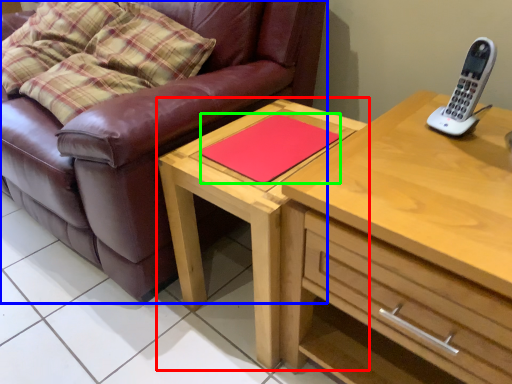
Question: Which object is positioned closest to table (highlighted by a red box)? Select from studio couch (highlighted by a blue box) and pad (highlighted by a green box).

Choices:
 (A) studio couch
 (B) pad

Answer: (B)